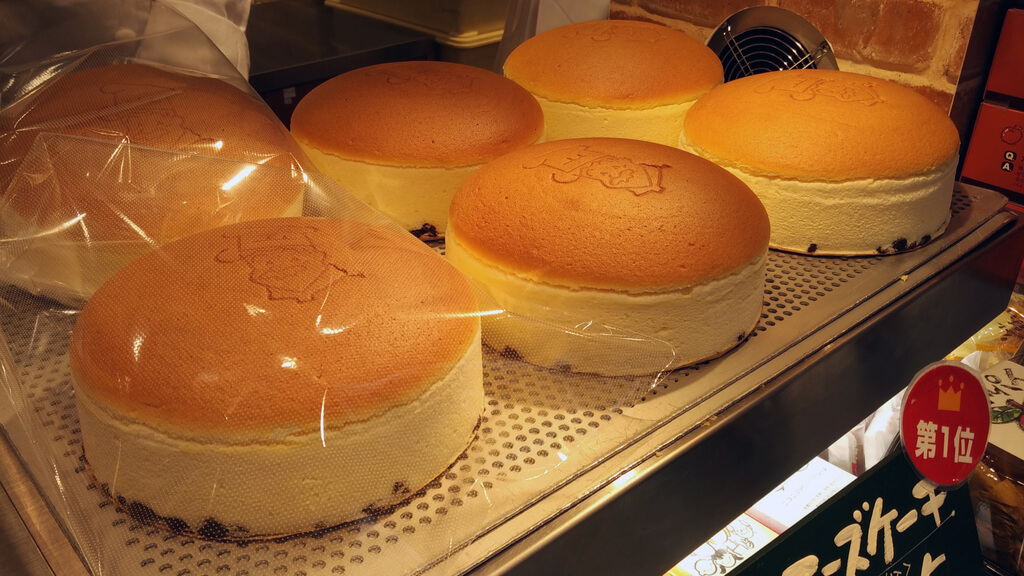
You are a GUI agent. You are given a task and a screenshot of the screen. Output one action in this format:
    pyautogui.click(x=<x>, y=<y>)
    Task: Click on the brick wall
    This screenshot has height=576, width=1024.
    Given the screenshot: What is the action you would take?
    pyautogui.click(x=898, y=37)